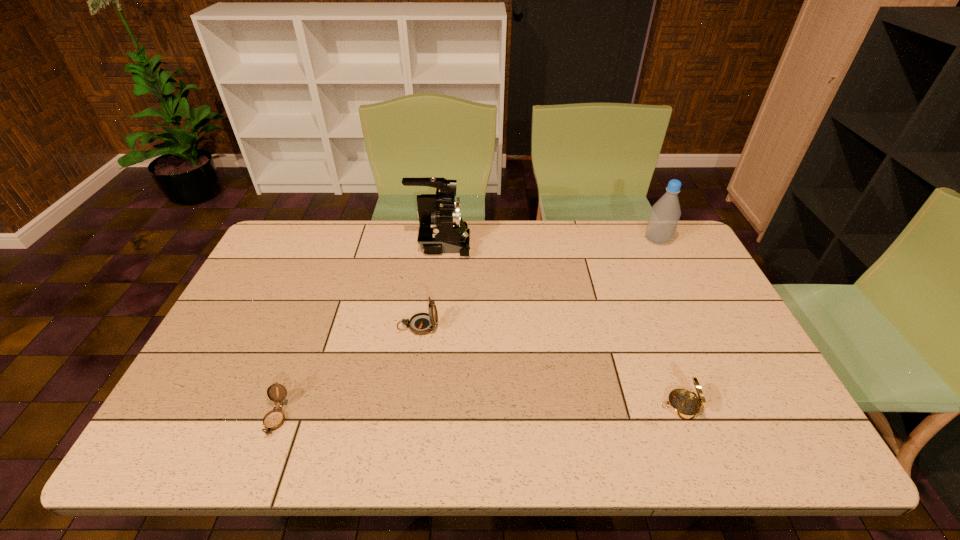
I want to click on camcorder, so click(442, 230).

The width and height of the screenshot is (960, 540). Find the location of `bottle`. bottle is located at coordinates (664, 216).

The width and height of the screenshot is (960, 540). What are the coordinates of `the second compass from left to right` in the screenshot? It's located at (422, 323).

This screenshot has width=960, height=540. Identify the location of the tallest compass. (422, 323).

This screenshot has height=540, width=960. I want to click on the second object from right to left, so click(x=684, y=404).

The height and width of the screenshot is (540, 960). What are the coordinates of `the second tallest compass` in the screenshot? It's located at point(684,404).

At what (x,y) coordinates should I click in order to perform the action: click on the shortest object. Please return your answer as a coordinate pair (x, y). Looking at the image, I should click on (274, 419).

Where is `the leftmost object`? The width and height of the screenshot is (960, 540). the leftmost object is located at coordinates (274, 419).

Where is `vacant space located on the lens mount of the camcorder`? Image resolution: width=960 pixels, height=540 pixels. vacant space located on the lens mount of the camcorder is located at coordinates (497, 244).

The height and width of the screenshot is (540, 960). I want to click on free spot located 0.290m on the front of the rightmost object, so click(691, 310).